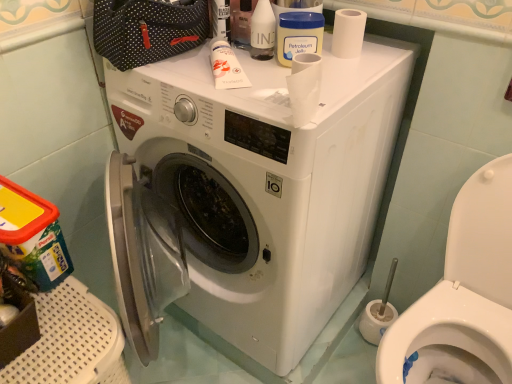
Locate an element on the screen. vacant area that is in front of translucent plastic bottle at upper center, which ranks as the first toiletry in right-to-left order is located at coordinates (260, 83).